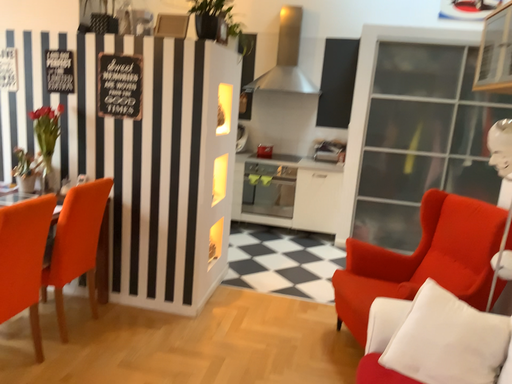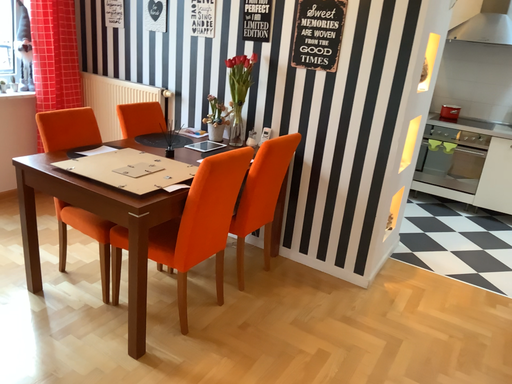
Question: Which way did the camera rotate in the video?

Choices:
 (A) rotated right
 (B) rotated left

Answer: (B)